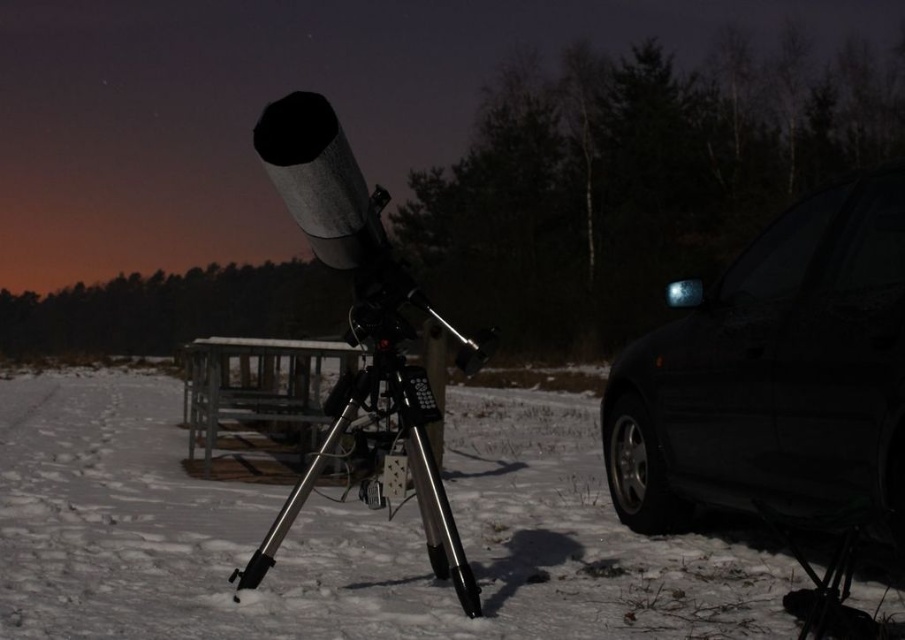
Question: Is black glossy car at right to the left of silver metallic tripod at center from the viewer's perspective?

Choices:
 (A) no
 (B) yes

Answer: (A)

Question: Considering the real-world distances, which object is farthest from the black glossy car at right?

Choices:
 (A) white matte snow at center
 (B) silver metallic tripod at center

Answer: (B)

Question: Is white matte snow at center smaller than silver metallic tripod at center?

Choices:
 (A) yes
 (B) no

Answer: (B)

Question: Based on their relative distances, which object is farther from the white matte snow at center?

Choices:
 (A) silver metallic tripod at center
 (B) black glossy car at right

Answer: (A)

Question: Does black glossy car at right have a greater width compared to silver metallic tripod at center?

Choices:
 (A) yes
 (B) no

Answer: (B)

Question: Which object appears closest to the camera in this image?

Choices:
 (A) white matte snow at center
 (B) silver metallic tripod at center

Answer: (A)